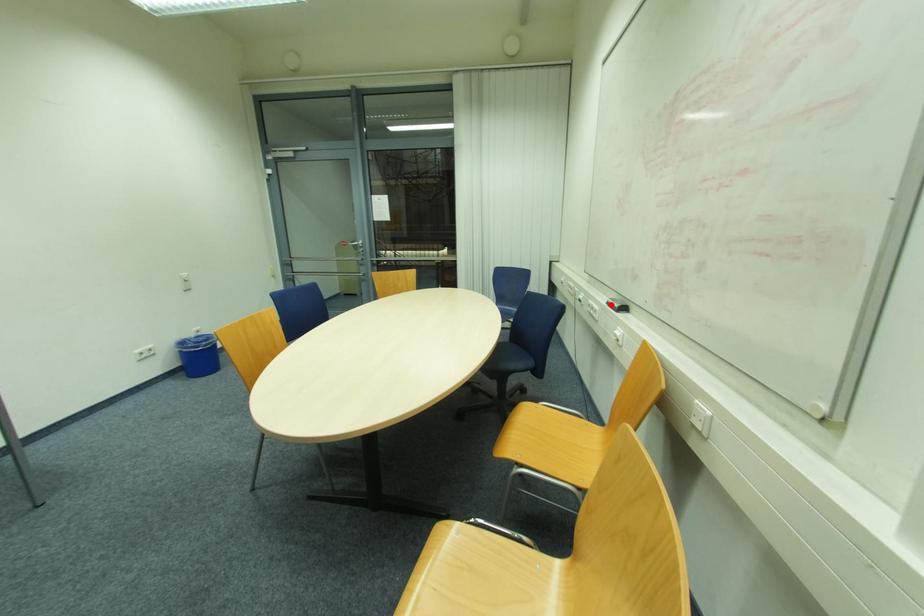
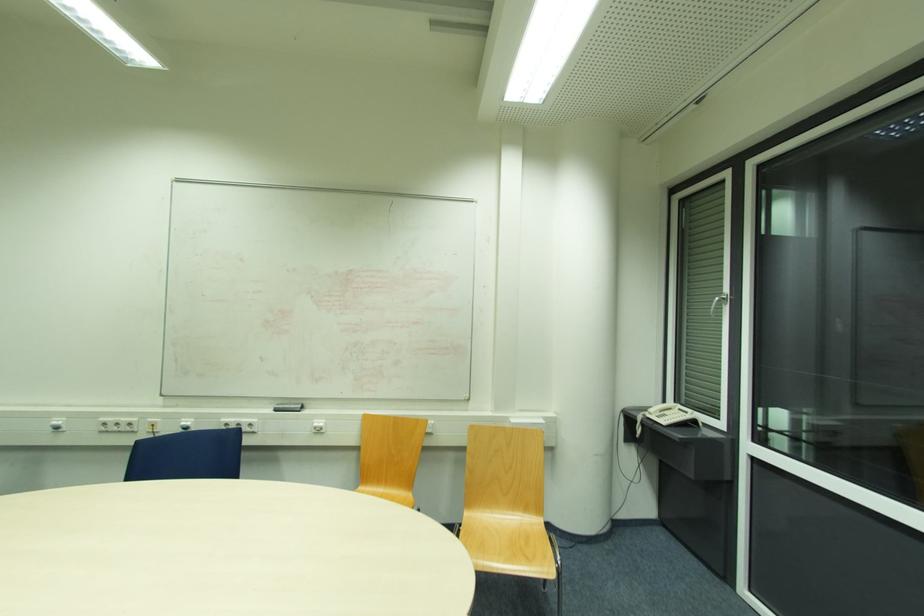
Question: I am providing you with two images of the same scene from different viewpoints. Given a red point in image1, look at the same physical point in image2. Is it:

Choices:
 (A) Closer to the viewpoint
 (B) Farther from the viewpoint

Answer: (B)